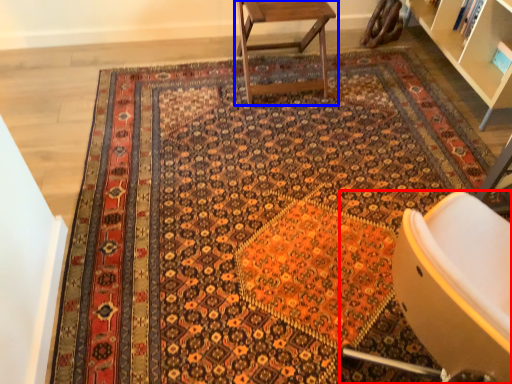
Question: Which object is closer to the camera taking this photo, chair (highlighted by a red box) or table (highlighted by a blue box)?

Choices:
 (A) chair
 (B) table

Answer: (A)